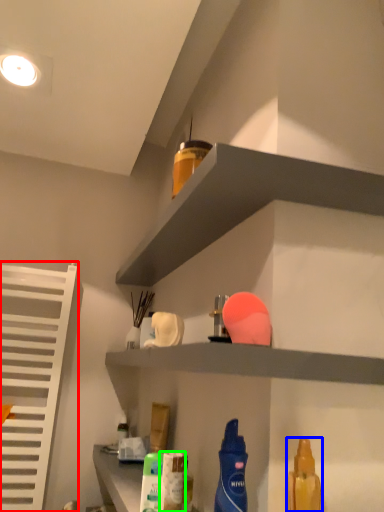
Question: Considering the real-world distances, which object is farthest from shutter (highlighted by a red box)? cleaning product (highlighted by a blue box) or cleaning product (highlighted by a green box)?

Choices:
 (A) cleaning product
 (B) cleaning product

Answer: (A)